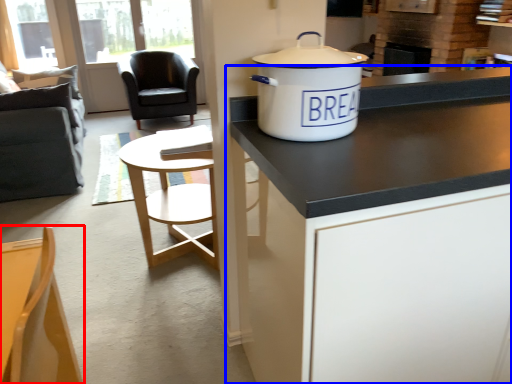
Question: Which object is closer to the camera taking this photo, chair (highlighted by a red box) or cabinetry (highlighted by a blue box)?

Choices:
 (A) chair
 (B) cabinetry

Answer: (A)